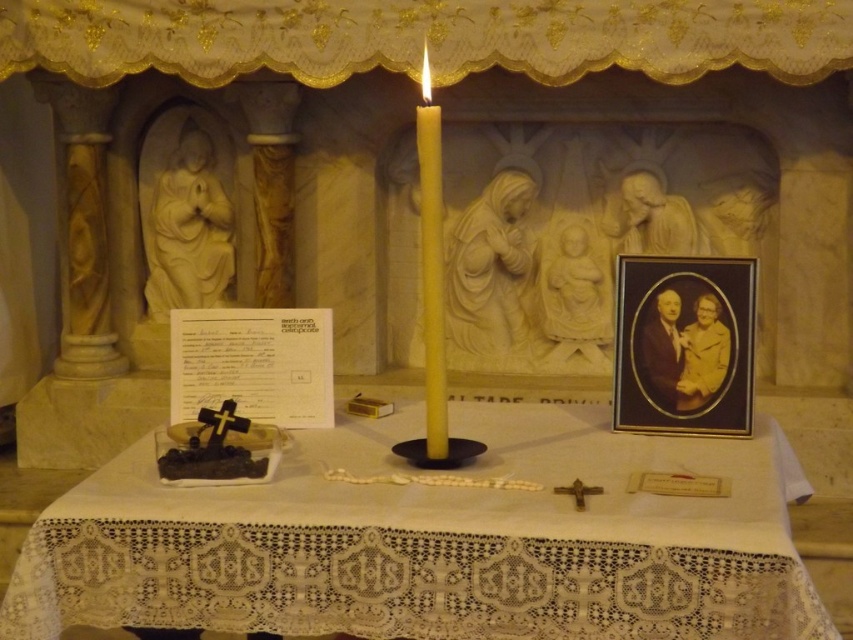
Question: Which of the following is the closest to the observer?

Choices:
 (A) (428, 276)
 (B) (790, 608)
 (C) (155, 140)

Answer: (B)

Question: Is white lace tablecloth at center further to camera compared to white marble statue at upper left?

Choices:
 (A) no
 (B) yes

Answer: (A)

Question: Which of the following is the farthest from the observer?

Choices:
 (A) white marble statue at upper left
 (B) yellow wax candle at center

Answer: (A)

Question: Among these objects, which one is farthest from the camera?

Choices:
 (A) white marble statue at upper left
 (B) yellow wax candle at center

Answer: (A)

Question: Is white lace tablecloth at center to the right of white marble statue at upper left from the viewer's perspective?

Choices:
 (A) yes
 (B) no

Answer: (A)

Question: Does white lace tablecloth at center have a smaller size compared to white marble statue at upper left?

Choices:
 (A) yes
 (B) no

Answer: (B)